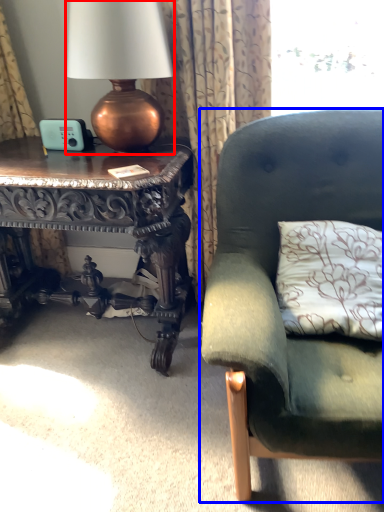
Question: Among these objects, which one is nearest to the camera, lamp (highlighted by a red box) or studio couch (highlighted by a blue box)?

Choices:
 (A) lamp
 (B) studio couch

Answer: (B)